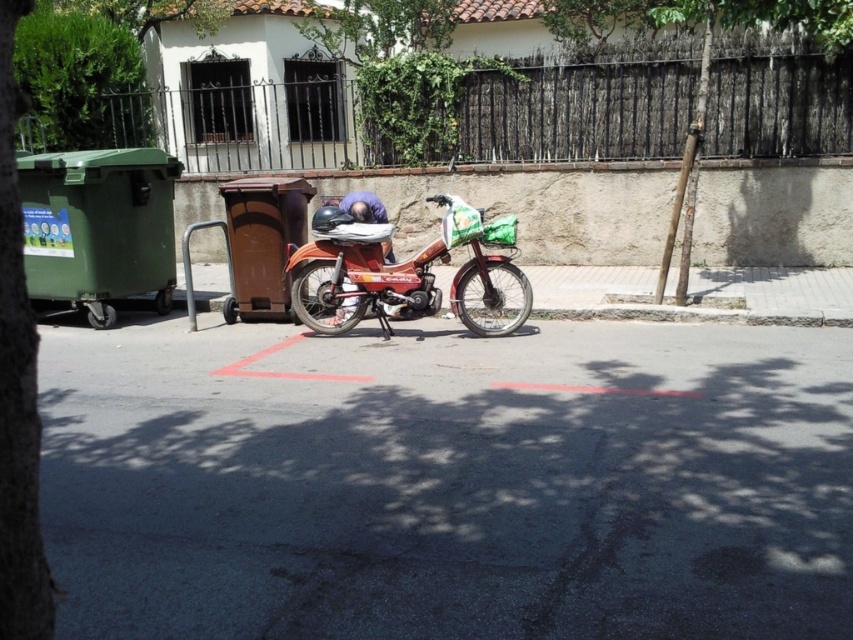
You are a pedestrian standing on the sidewalk and looking at the green leafy tree at upper center and the brown rough wooden pole at right. Which object is closer to you?

The green leafy tree at upper center is closer to you because the brown rough wooden pole at right is behind it.

You are standing at the point with coordinates (16, 385) in the image. What object are you standing on?

You are standing on the green leafy tree at left.